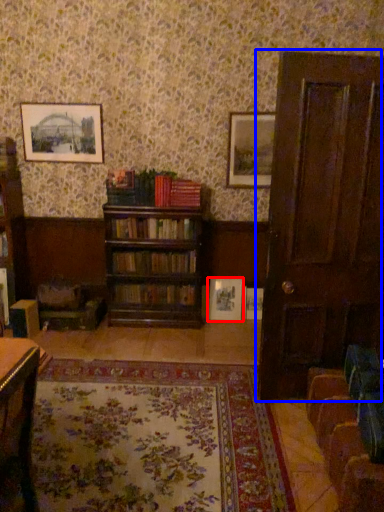
Question: Which point is further to the camera, picture frame (highlighted by a red box) or door (highlighted by a blue box)?

Choices:
 (A) picture frame
 (B) door

Answer: (A)